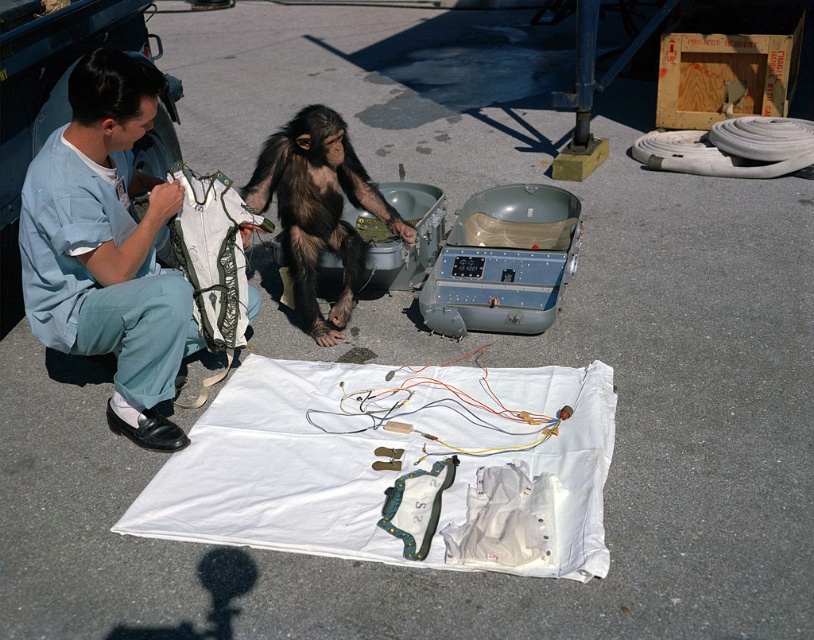
Between light blue fabric at left and brown furry monkey at center, which one has less height?

brown furry monkey at center

Is point (34, 196) in front of point (287, 221)?

That is True.

Locate an element on the screen. light blue fabric at left is located at coordinates (108, 246).